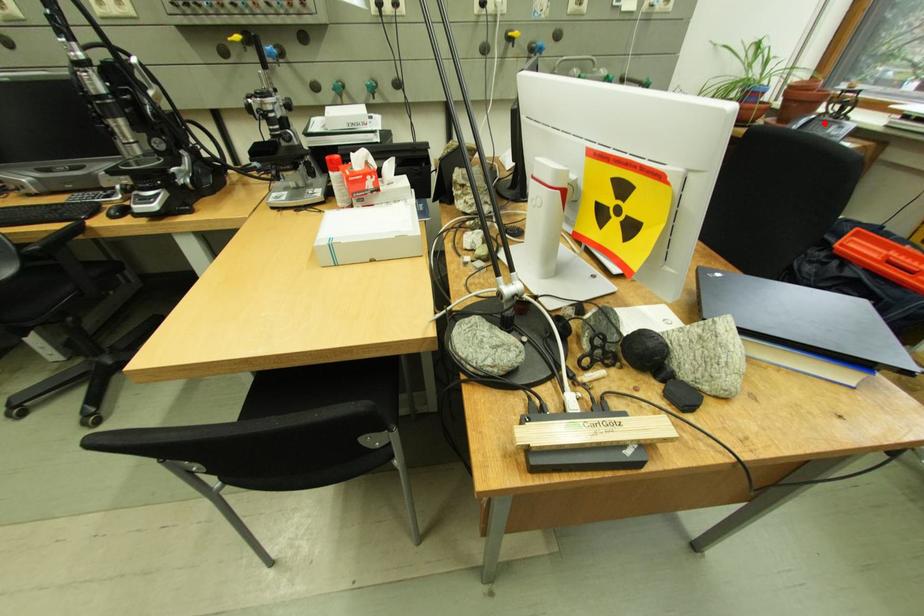
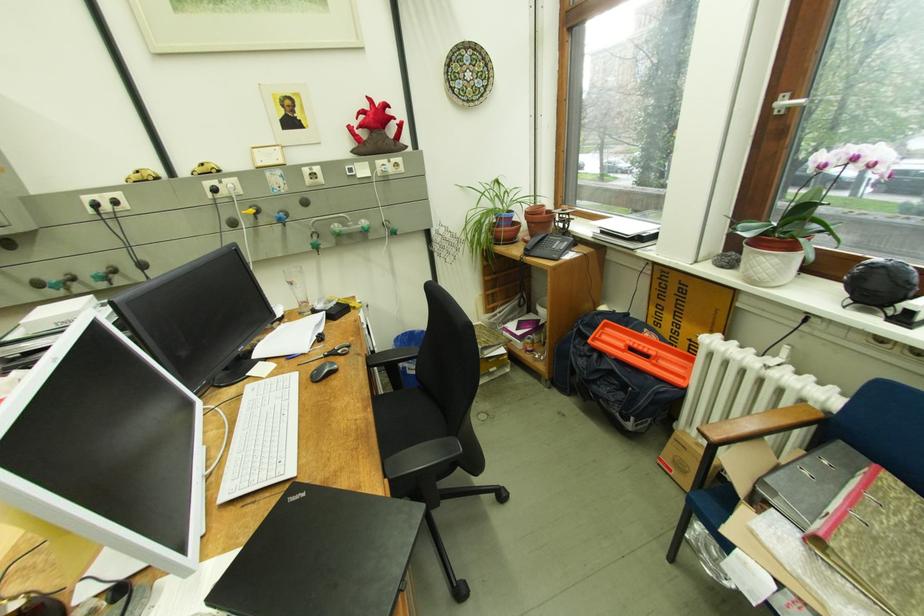
Question: A red point is marked in image1. In image2, is the corresponding 3D point closer to the camera or farther? Reply with the corresponding letter.

Choices:
 (A) The corresponding 3D point is closer.
 (B) The corresponding 3D point is farther.

Answer: (A)